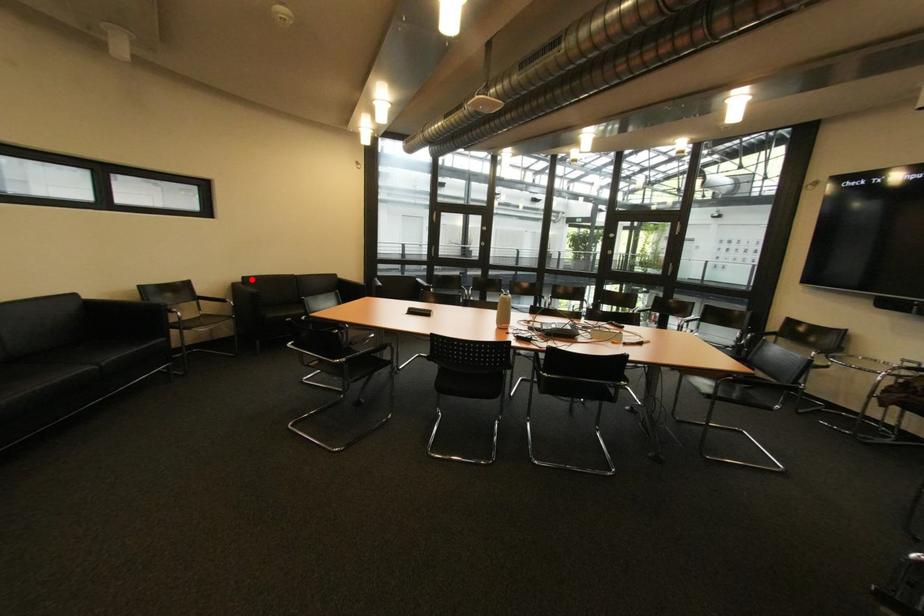
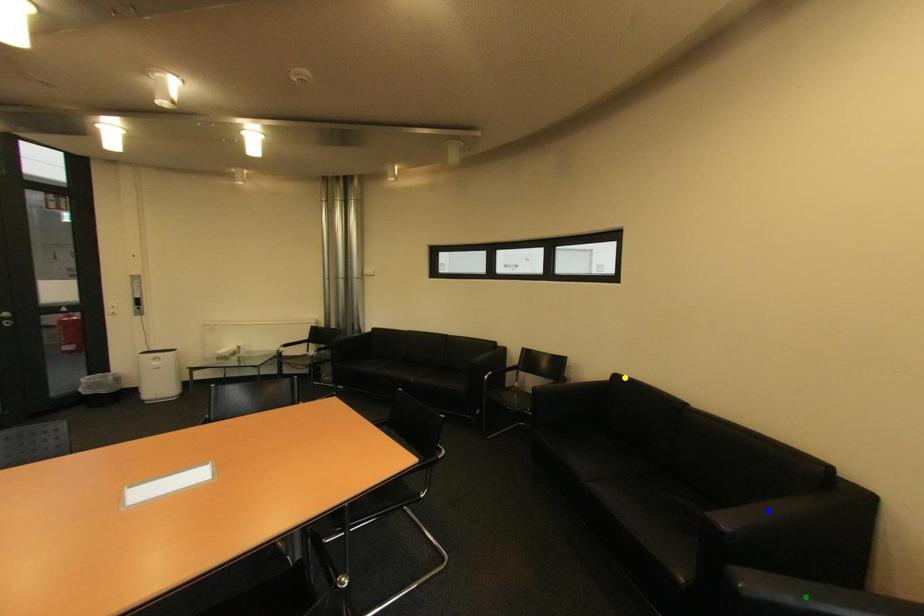
Question: I am providing you with two images of the same scene from different viewpoints. A red point is marked on the first image. You are given multiple points on the second image. Which spot in image 2 lines up with the point in image 1?

Choices:
 (A) green point
 (B) blue point
 (C) yellow point

Answer: (C)